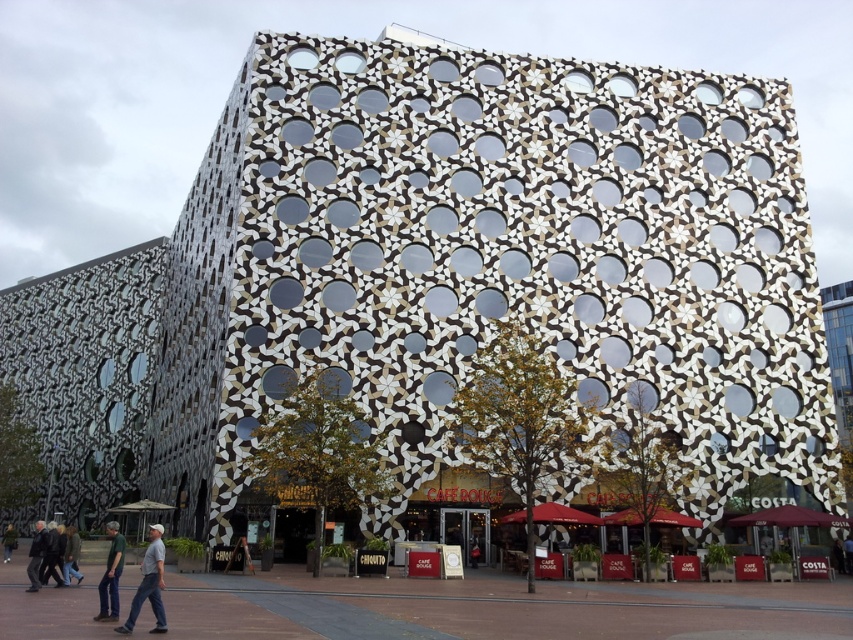
Question: Can you confirm if dark green shirt at lower left is wider than dark gray jacket at lower left?

Choices:
 (A) yes
 (B) no

Answer: (B)

Question: Which is farther from the dark gray jacket at lower left?

Choices:
 (A) green fabric jacket at lower left
 (B) gray fabric pants at lower left
 (C) dark green shirt at lower left

Answer: (B)

Question: Which object appears closest to the camera in this image?

Choices:
 (A) green fabric jacket at lower left
 (B) gray fabric pants at lower left
 (C) dark gray jacket at lower left
 (D) dark green shirt at lower left

Answer: (B)

Question: Among these objects, which one is farthest from the camera?

Choices:
 (A) gray fabric pants at lower left
 (B) dark green shirt at lower left

Answer: (B)

Question: Does gray fabric pants at lower left lie behind dark green shirt at lower left?

Choices:
 (A) yes
 (B) no

Answer: (B)

Question: Is gray fabric pants at lower left positioned in front of dark gray jacket at lower left?

Choices:
 (A) yes
 (B) no

Answer: (A)